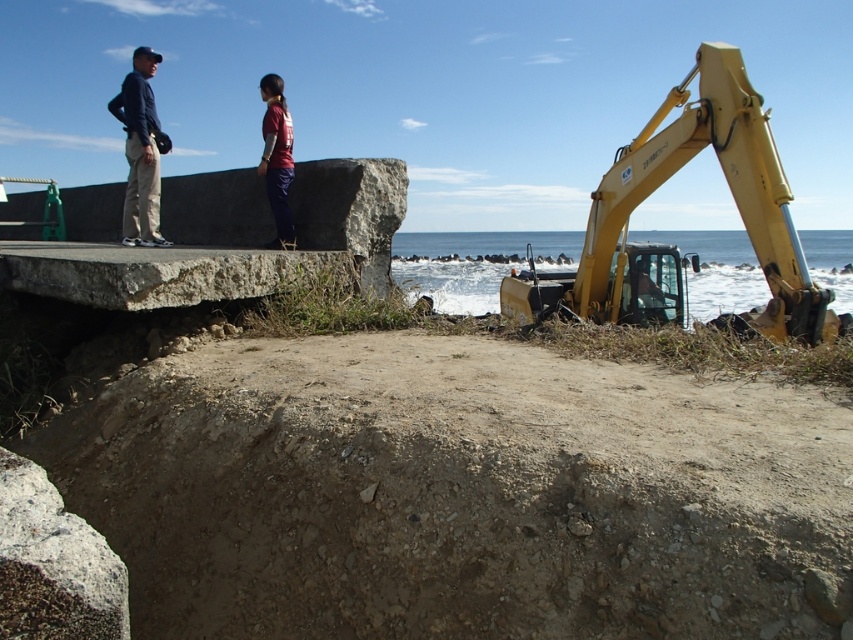
Question: Does matte black clothing at upper left appear over maroon fabric pants at center?

Choices:
 (A) yes
 (B) no

Answer: (B)

Question: Is matte black clothing at upper left closer to camera compared to dark blue fabric jacket at upper left?

Choices:
 (A) yes
 (B) no

Answer: (A)

Question: Which of the following is the closest to the observer?

Choices:
 (A) matte black clothing at upper left
 (B) dark blue fabric jacket at upper left
 (C) maroon fabric pants at center

Answer: (C)

Question: Which point is closer to the camera taking this photo?

Choices:
 (A) (129, 116)
 (B) (126, 202)
 (C) (677, 118)
 (D) (274, 84)

Answer: (D)

Question: Which object is farther from the camera taking this photo?

Choices:
 (A) matte black clothing at upper left
 (B) dark blue fabric jacket at upper left

Answer: (B)

Question: Does yellow metallic excavator at right have a greater width compared to maroon fabric pants at center?

Choices:
 (A) yes
 (B) no

Answer: (A)